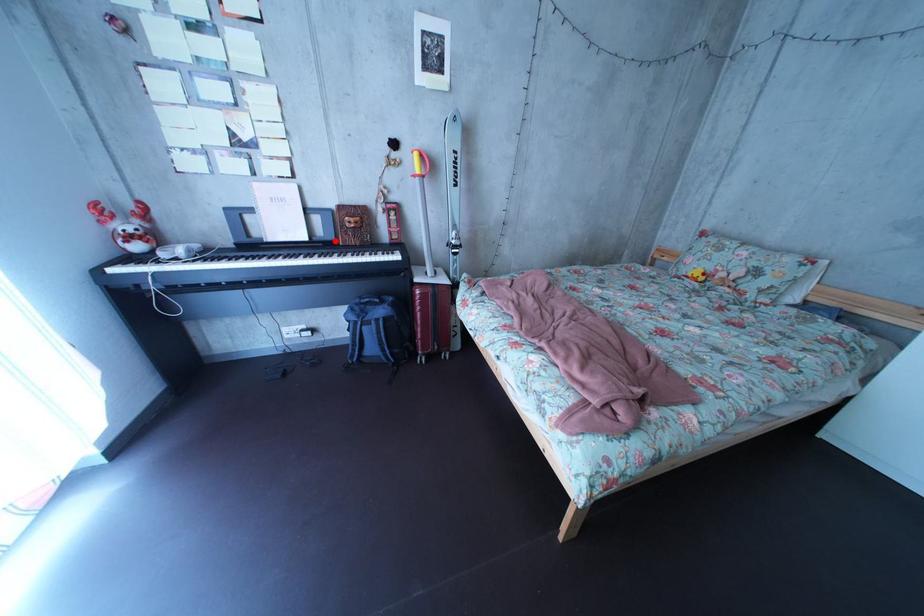
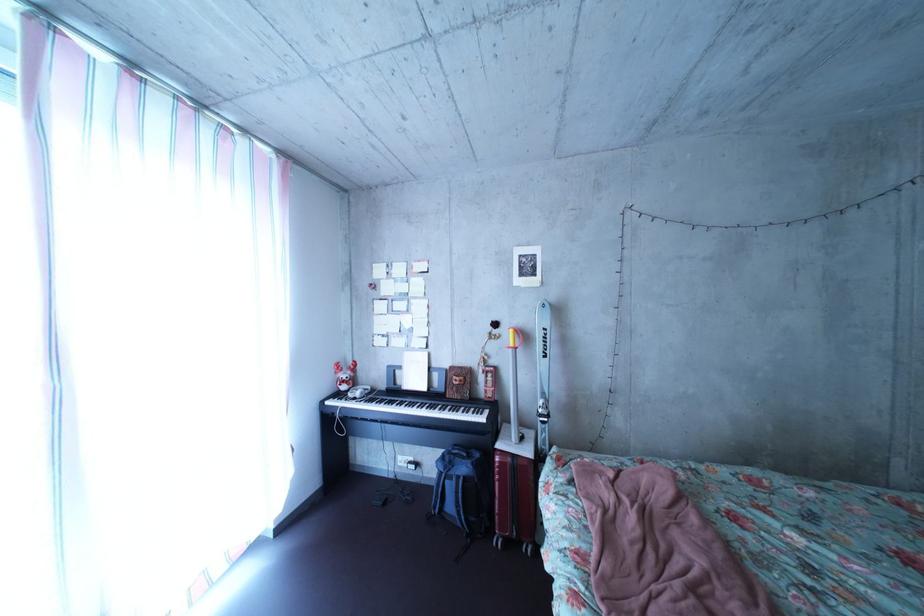
Find the pixel in the second image that matches the highlighted location in the first image.

(452, 392)